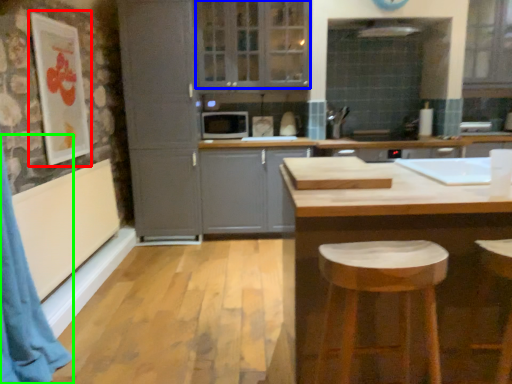
Question: Which object is positioned farthest from picture frame (highlighted by a red box)? Select from window (highlighted by a blue box) and curtain (highlighted by a green box).

Choices:
 (A) window
 (B) curtain

Answer: (A)